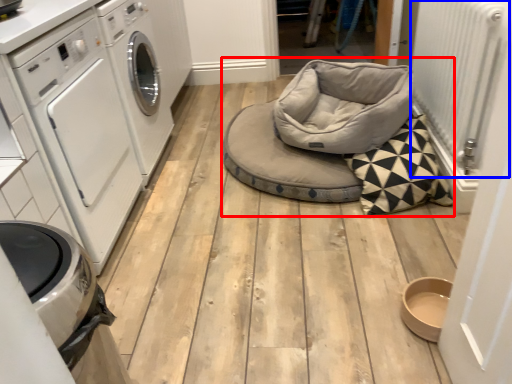
Question: Which point is closer to the camera, daybed (highlighted by a red box) or radiator (highlighted by a blue box)?

Choices:
 (A) daybed
 (B) radiator

Answer: (B)